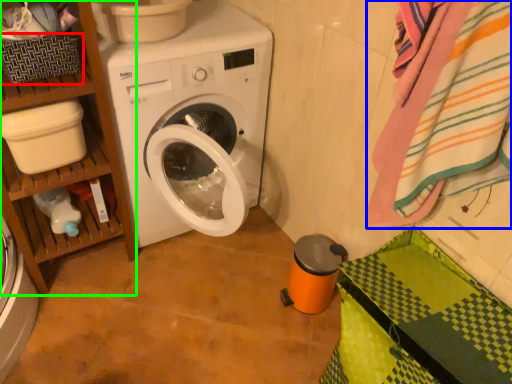
Question: Which object is positioned farthest from basket (highlighted by a red box)? Select from bath towel (highlighted by a blue box) and shelf (highlighted by a green box).

Choices:
 (A) bath towel
 (B) shelf

Answer: (A)